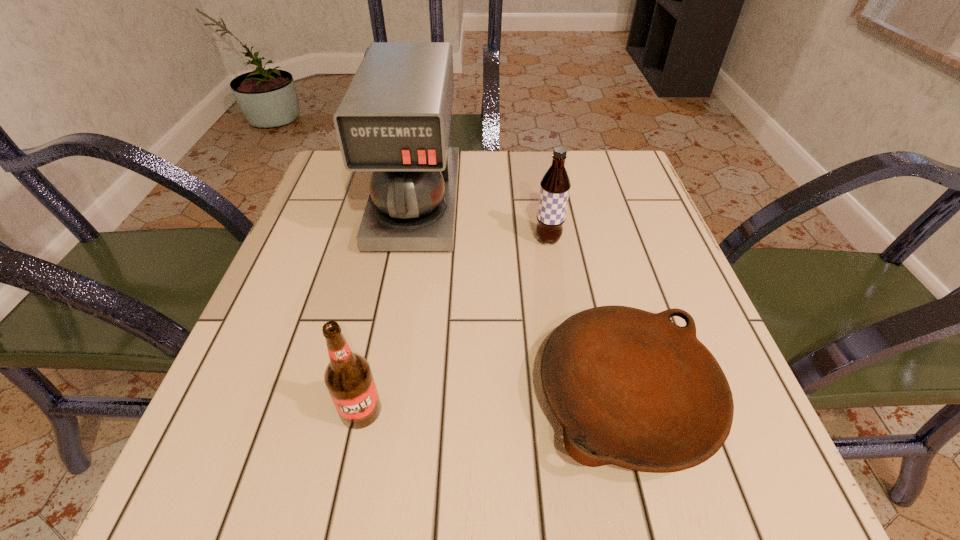
Locate an element on the screen. This screenshot has height=540, width=960. free location that satisfies the following two spatial constraints: 1. on the carafe side of the farther root beer; 2. on the left side of the coffee maker is located at coordinates (410, 239).